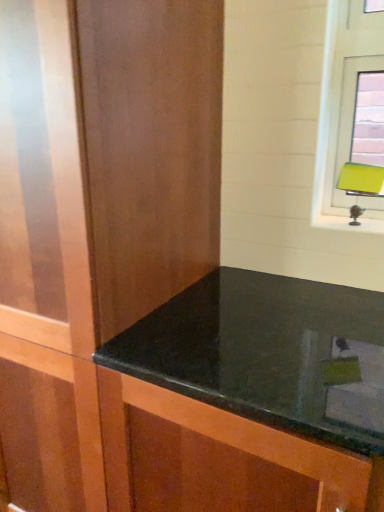
Identify the location of vacant area on top of black granite countertop at center (from a real-world perspective). (258, 339).